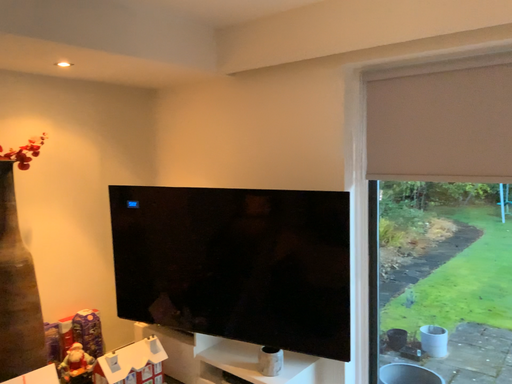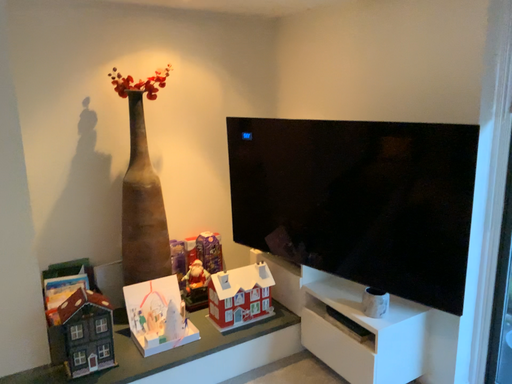
Question: How did the camera likely rotate when shooting the video?

Choices:
 (A) rotated right
 (B) rotated left

Answer: (B)